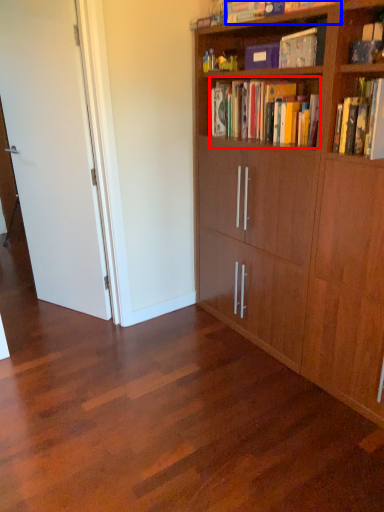
Question: Among these objects, which one is nearest to the camera, book (highlighted by a red box) or book (highlighted by a blue box)?

Choices:
 (A) book
 (B) book

Answer: (A)